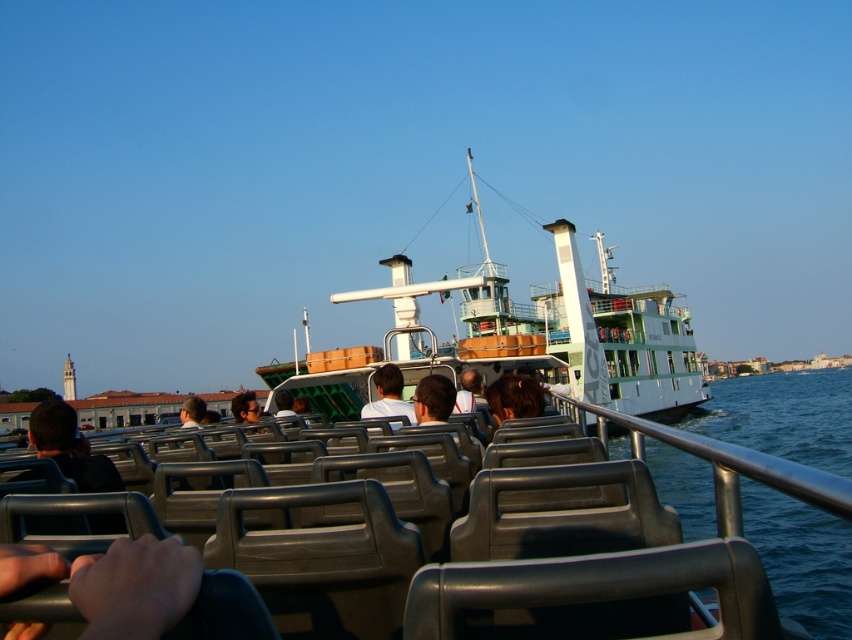
Locate an element on the screen. The height and width of the screenshot is (640, 852). green matte ferry at center is located at coordinates (553, 332).

Does green matte ferry at center appear on the left side of white matte shirt at center?

In fact, green matte ferry at center is to the right of white matte shirt at center.

Does point (623, 355) lie behind point (380, 390)?

Yes, it is.

I want to click on green matte ferry at center, so click(x=553, y=332).

Can you confirm if green matte ferry at center is taller than dark brown hair at center?

Indeed, green matte ferry at center has a greater height compared to dark brown hair at center.

Is green matte ferry at center in front of dark brown hair at center?

No, green matte ferry at center is further to the viewer.

Is point (545, 333) closer to camera compared to point (246, 413)?

No, it is behind (246, 413).

Where is `green matte ferry at center`? The height and width of the screenshot is (640, 852). green matte ferry at center is located at coordinates (553, 332).

The image size is (852, 640). What are the coordinates of `white matte shirt at center` in the screenshot? It's located at (389, 394).

Who is more forward, (412, 413) or (252, 404)?

Positioned in front is point (412, 413).

Locate an element on the screen. The height and width of the screenshot is (640, 852). white matte shirt at center is located at coordinates (389, 394).

Where is `white matte shirt at center`? The width and height of the screenshot is (852, 640). white matte shirt at center is located at coordinates (389, 394).